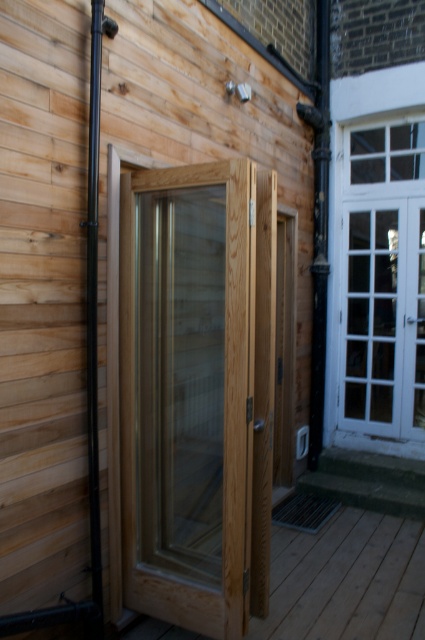
Question: Which of the following is the farthest from the observer?

Choices:
 (A) (405, 216)
 (B) (138, 604)

Answer: (A)

Question: Can you confirm if natural wood door at center is positioned above white glass door at upper right?

Choices:
 (A) no
 (B) yes

Answer: (A)

Question: Does natural wood door at center appear under white glass door at upper right?

Choices:
 (A) no
 (B) yes

Answer: (B)

Question: Among these objects, which one is farthest from the camera?

Choices:
 (A) natural wood door at center
 (B) white glass door at upper right

Answer: (B)

Question: Is natural wood door at center to the right of white glass door at upper right from the viewer's perspective?

Choices:
 (A) yes
 (B) no

Answer: (B)